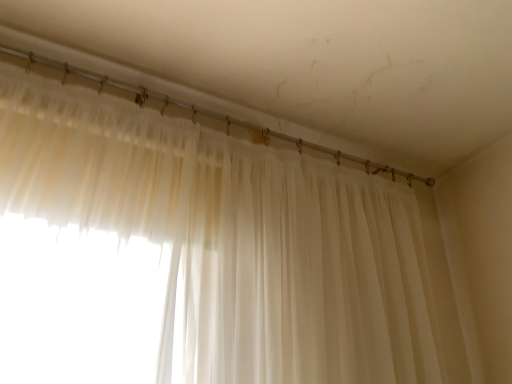
The height and width of the screenshot is (384, 512). What do you see at coordinates (308, 273) in the screenshot?
I see `white sheer curtain at center` at bounding box center [308, 273].

Locate an element on the screen. The image size is (512, 384). white sheer curtain at center is located at coordinates (308, 273).

This screenshot has height=384, width=512. I want to click on white sheer curtain at center, so click(308, 273).